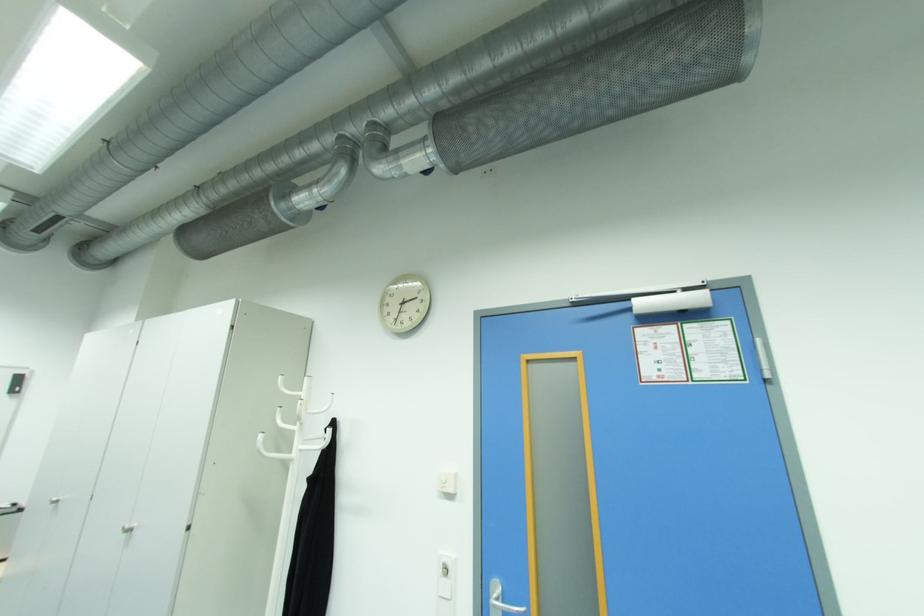
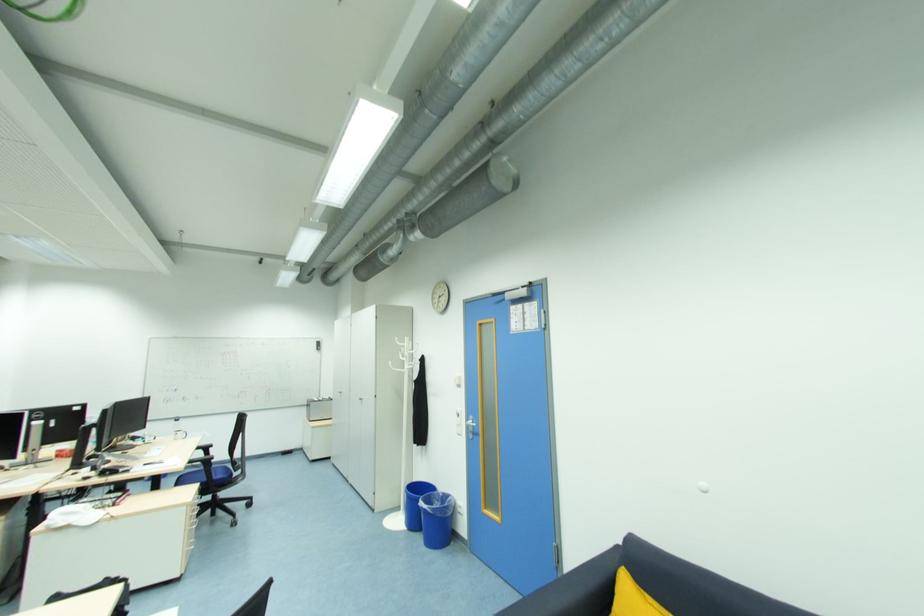
Locate, in the second image, the point that corresponds to pixel 58 504 in the first image.

(344, 394)